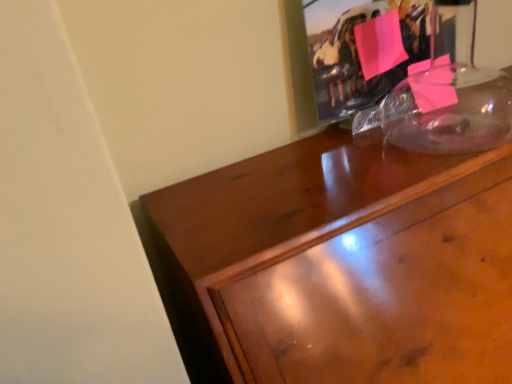
The height and width of the screenshot is (384, 512). Identify the location of blank space situated above glossy wood desk at upper right (from a real-world perspective). (384, 158).